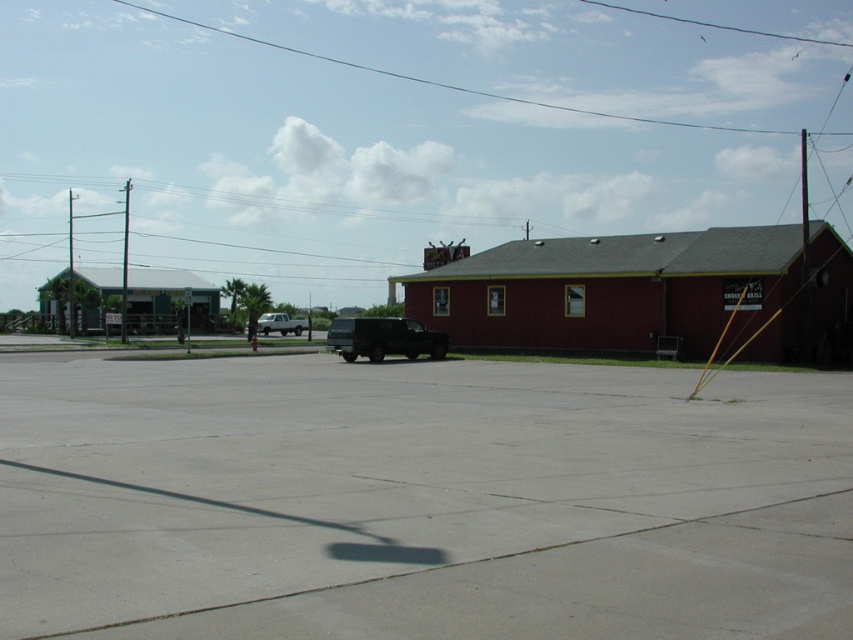
You are standing at the entrance of the red building and want to park your car near the shiny black truck at center. Which direction should you drive relative to the brushed metal pole at left?

The shiny black truck at center is to the right of the brushed metal pole at left, so you should drive towards the right side of the brushed metal pole at left to park near the shiny black truck at center.

You are standing in the parking lot and want to park your car behind the shiny black truck at center. Can you see the brushed metal pole at left from your car if you park directly behind it?

The shiny black truck at center has a lesser height compared to brushed metal pole at left, so yes, you can see the brushed metal pole at left from your car parked directly behind the shiny black truck at center because the pole is taller and will be visible over the truck.

You are a delivery driver who needs to park your vehicle in the parking lot. You see the shiny black truck at center and the brushed metal pole at left. Which one takes up more space in the parking lot?

The brushed metal pole at left takes up more space in the parking lot than the shiny black truck at center because the shiny black truck at center occupies less space than brushed metal pole at left.